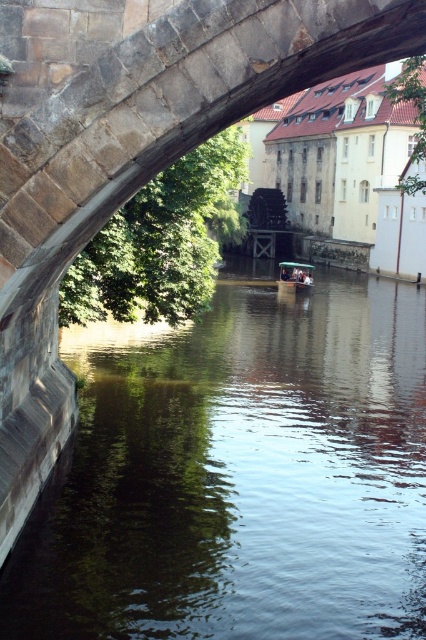
Question: Does dark green water at center have a larger size compared to wooden boat at center?

Choices:
 (A) no
 (B) yes

Answer: (B)

Question: Can you confirm if dark green water at center is thinner than wooden boat at center?

Choices:
 (A) yes
 (B) no

Answer: (B)

Question: Is dark green water at center above wooden boat at center?

Choices:
 (A) yes
 (B) no

Answer: (B)